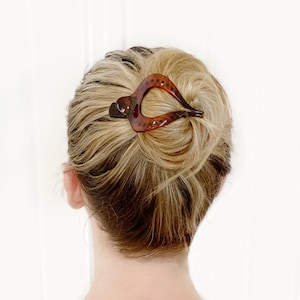
Find the location of `pattern on wall`. pattern on wall is located at coordinates (87, 24), (123, 20).